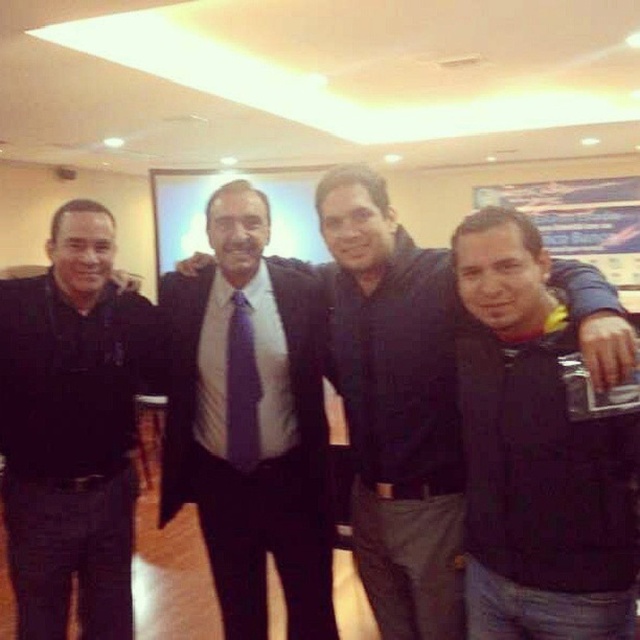
You are a photographer adjusting your camera settings to focus on two specific points in the image. The first point is at coordinates point (568, 637) and the second point is at coordinates point (428, 275). Since you want to ensure both points are in focus, which point should you prioritize focusing on to achieve the best depth of field?

You should prioritize focusing on point (428, 275) because it is farther from the camera than point (568, 637), and depth of field is typically optimized when focusing on the point farther away to ensure both near and far points are in focus.